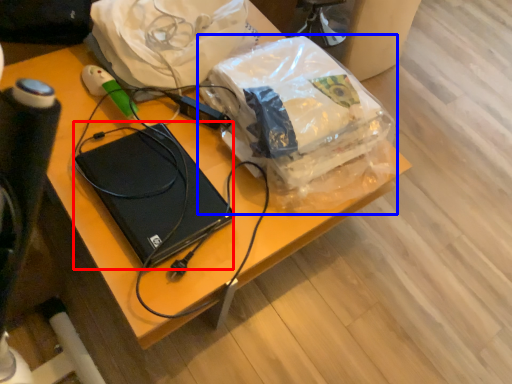
Question: Which point is further to the camera, computer (highlighted by a red box) or plastic bag (highlighted by a blue box)?

Choices:
 (A) computer
 (B) plastic bag

Answer: (B)